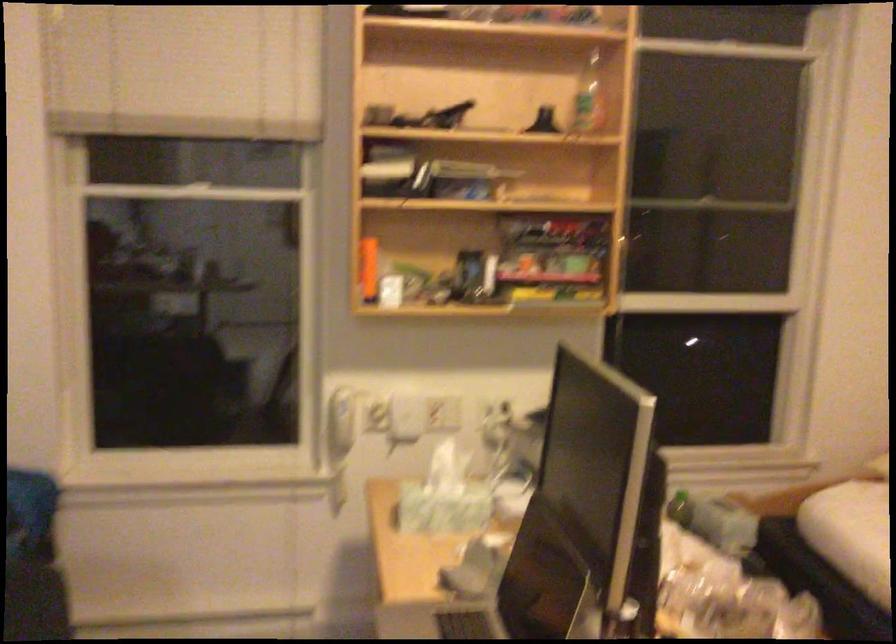
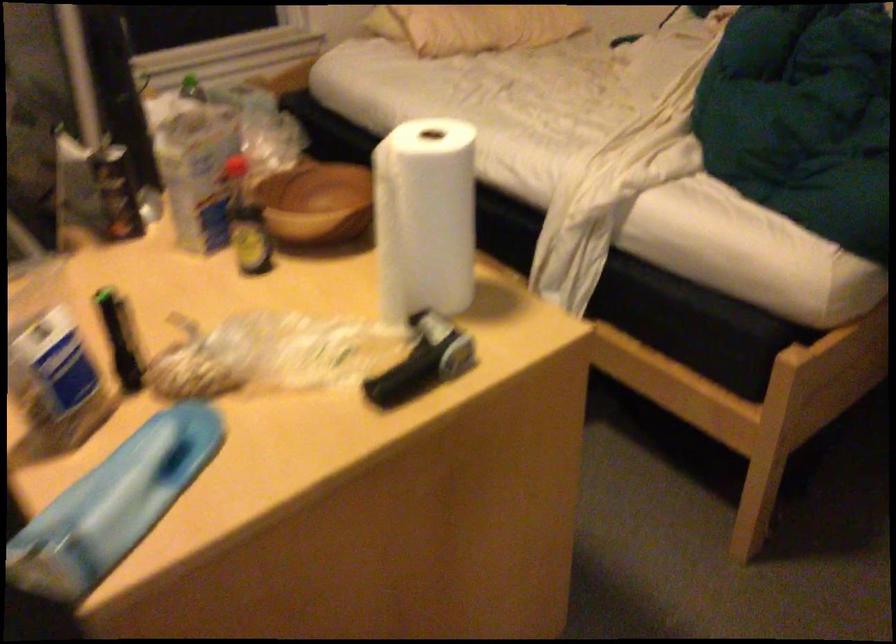
How did the camera likely rotate?

The camera rotated toward right-down.